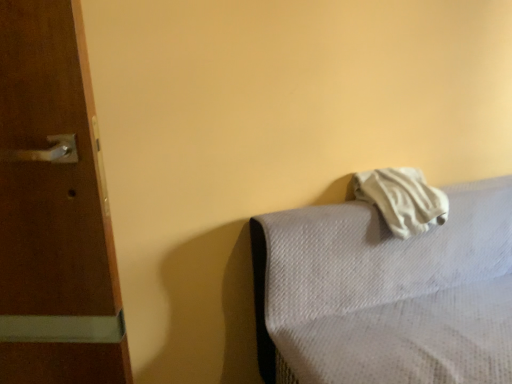
Question: In terms of width, does white textured mattress at right look wider or thinner when compared to white soft towel at upper right?

Choices:
 (A) wide
 (B) thin

Answer: (A)

Question: Considering their positions, is white textured mattress at right located in front of or behind white soft towel at upper right?

Choices:
 (A) behind
 (B) front

Answer: (B)

Question: Is white textured mattress at right situated inside white soft towel at upper right or outside?

Choices:
 (A) outside
 (B) inside

Answer: (A)

Question: From the image's perspective, is white soft towel at upper right positioned above or below white textured mattress at right?

Choices:
 (A) above
 (B) below

Answer: (A)

Question: Choose the correct answer: Is white soft towel at upper right inside white textured mattress at right or outside it?

Choices:
 (A) outside
 (B) inside

Answer: (B)

Question: Is white soft towel at upper right in front of or behind white textured mattress at right in the image?

Choices:
 (A) behind
 (B) front

Answer: (A)

Question: Is white soft towel at upper right wider or thinner than white textured mattress at right?

Choices:
 (A) thin
 (B) wide

Answer: (A)